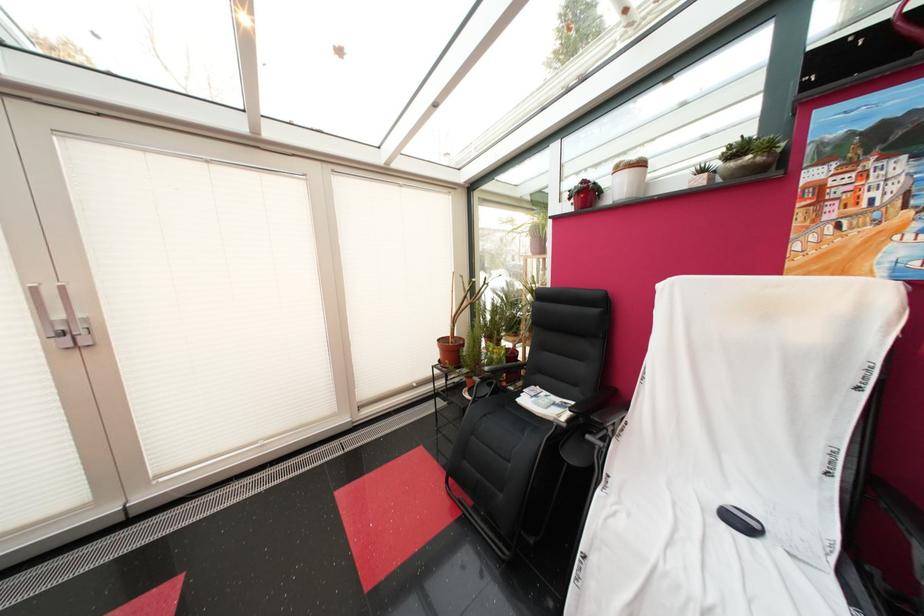
Describe the element at coordinates (739, 521) in the screenshot. I see `the black remote control` at that location.